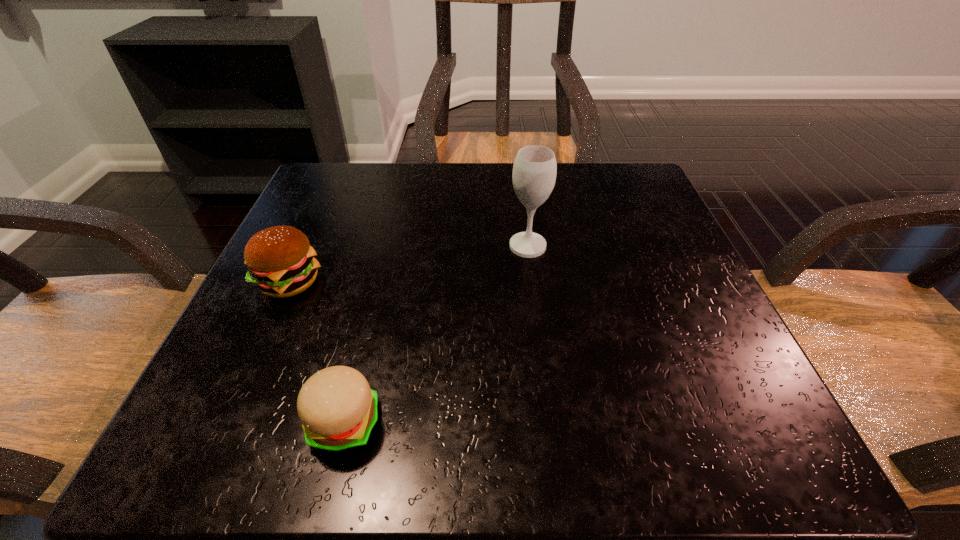
This screenshot has height=540, width=960. Find the location of `the rightmost object`. the rightmost object is located at coordinates (534, 171).

You are a GUI agent. You are given a task and a screenshot of the screen. Output one action in this format:
    pyautogui.click(x=<x>, y=<y>)
    Task: Click on the farthest object
    
    Given the screenshot: What is the action you would take?
    534,171

You are a GUI agent. You are given a task and a screenshot of the screen. Output one action in this format:
    pyautogui.click(x=<x>, y=<y>)
    Task: Click on the second shortest object
    The image size is (960, 540).
    Given the screenshot: What is the action you would take?
    pyautogui.click(x=281, y=262)

Where is `the taller hamburger`? the taller hamburger is located at coordinates (281, 262).

The image size is (960, 540). I want to click on the nearer hamburger, so click(x=338, y=410).

This screenshot has height=540, width=960. I want to click on the nearest object, so click(338, 410).

Find the location of `free space located on the front of the rightmost object`. free space located on the front of the rightmost object is located at coordinates (546, 398).

The image size is (960, 540). I want to click on free space located on the back of the farther hamburger, so click(x=339, y=173).

Image resolution: width=960 pixels, height=540 pixels. Identify the location of vacant space located 0.330m on the right of the shortest object. (644, 423).

At what (x,y) coordinates should I click in order to perform the action: click on object at the near edge. Please return your answer as a coordinate pair (x, y). The width and height of the screenshot is (960, 540). Looking at the image, I should click on (338, 410).